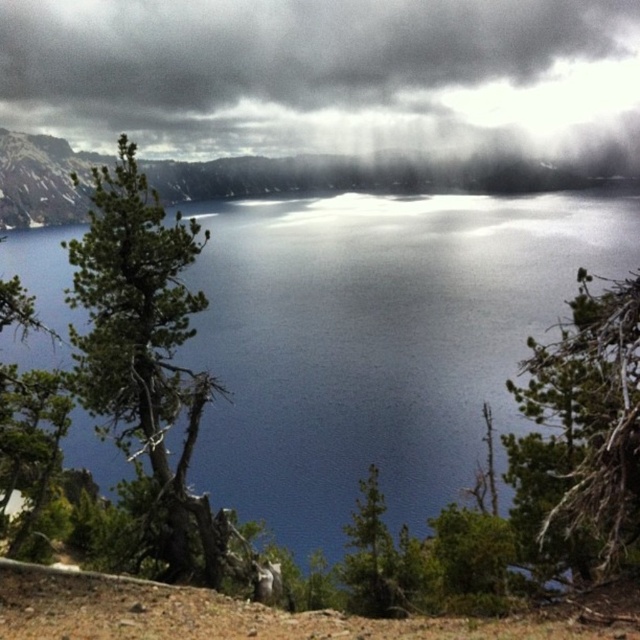
Question: Which object is positioned farthest from the green needle-like foliage at center?

Choices:
 (A) green matte tree at center
 (B) green textured tree at left
 (C) blue reflective water at center
 (D) dark gray cloud at upper center

Answer: (D)

Question: Does blue reflective water at center have a smaller size compared to green needle-like foliage at center?

Choices:
 (A) no
 (B) yes

Answer: (A)

Question: Can you confirm if green needle-like foliage at center is wider than green matte tree at center?

Choices:
 (A) no
 (B) yes

Answer: (B)

Question: Estimate the real-world distances between objects in this image. Which object is closer to the blue reflective water at center?

Choices:
 (A) green needle-like foliage at center
 (B) green matte tree at center

Answer: (A)

Question: Which point appears farthest from the camera in this image?

Choices:
 (A) (161, 301)
 (B) (316, 472)
 (C) (170, 67)
 (D) (356, 609)

Answer: (C)

Question: Can you confirm if blue reflective water at center is positioned to the right of green matte tree at center?

Choices:
 (A) no
 (B) yes

Answer: (B)